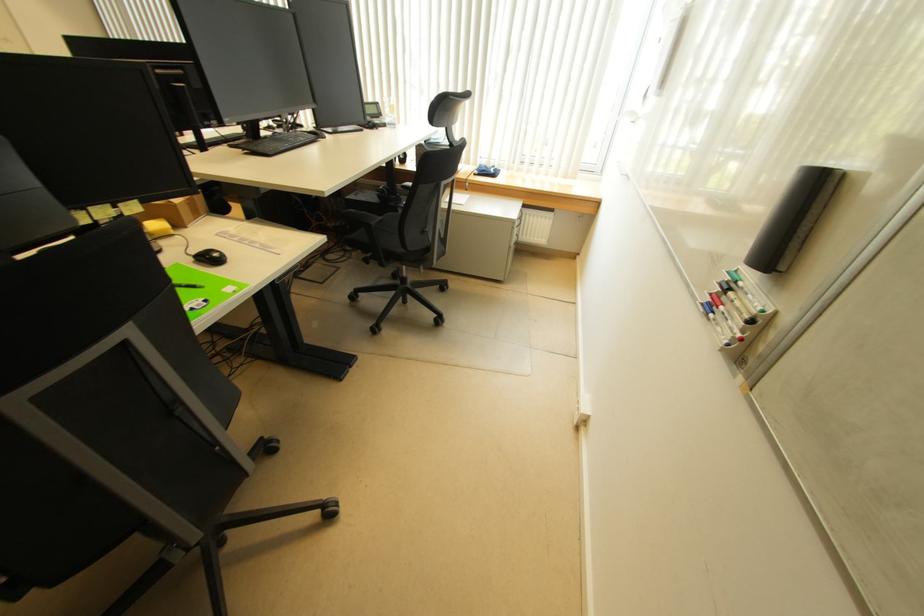
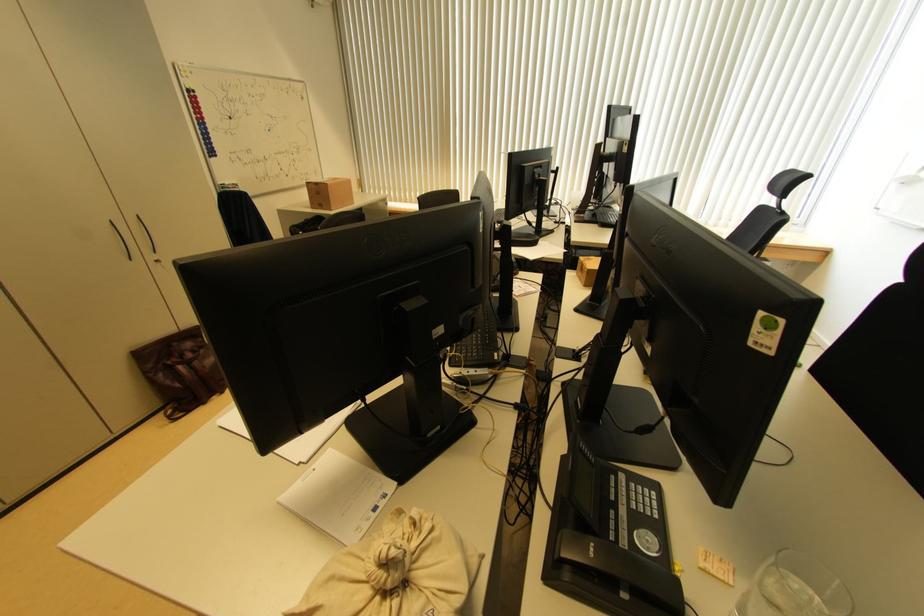
Question: I am providing you with two images of the same scene from different viewpoints. Which of the following objects are not visible in image2?

Choices:
 (A) beige cloth bag
 (B) phone handset
 (C) blue binder spine hole
 (D) clear drinking glass

Answer: (D)